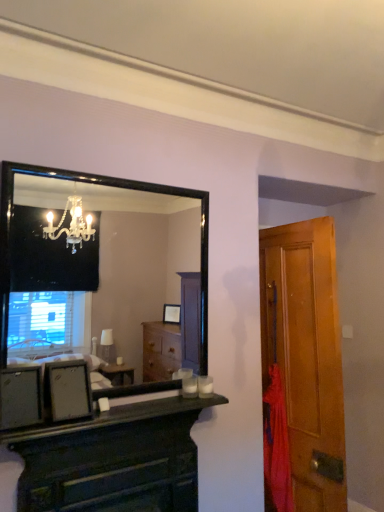
Question: Can you confirm if black glossy mirror at upper left is positioned to the right of dark wood chest of drawers at center?

Choices:
 (A) yes
 (B) no

Answer: (B)

Question: Is dark wood chest of drawers at center a part of black glossy mirror at upper left?

Choices:
 (A) yes
 (B) no

Answer: (B)

Question: Is black glossy mirror at upper left oriented towards dark wood chest of drawers at center?

Choices:
 (A) yes
 (B) no

Answer: (B)

Question: Considering the relative sizes of black glossy mirror at upper left and dark wood chest of drawers at center in the image provided, is black glossy mirror at upper left taller than dark wood chest of drawers at center?

Choices:
 (A) no
 (B) yes

Answer: (B)

Question: Are black glossy mirror at upper left and dark wood chest of drawers at center far apart?

Choices:
 (A) yes
 (B) no

Answer: (A)

Question: From the image's perspective, is black glossy mirror at upper left on dark wood chest of drawers at center?

Choices:
 (A) no
 (B) yes

Answer: (B)

Question: From a real-world perspective, does wooden door at right stand above matte black picture frame at lower left?

Choices:
 (A) no
 (B) yes

Answer: (A)

Question: Can you see wooden door at right touching matte black picture frame at lower left?

Choices:
 (A) yes
 (B) no

Answer: (B)

Question: From the image's perspective, does wooden door at right appear higher than matte black picture frame at lower left?

Choices:
 (A) yes
 (B) no

Answer: (B)

Question: Is wooden door at right smaller than matte black picture frame at lower left?

Choices:
 (A) no
 (B) yes

Answer: (A)

Question: Could you tell me if wooden door at right is facing matte black picture frame at lower left?

Choices:
 (A) no
 (B) yes

Answer: (A)

Question: From the image's perspective, is wooden door at right below matte black picture frame at lower left?

Choices:
 (A) yes
 (B) no

Answer: (A)

Question: Would you say dark wood chest of drawers at center is a long distance from red fabric at right?

Choices:
 (A) yes
 (B) no

Answer: (B)